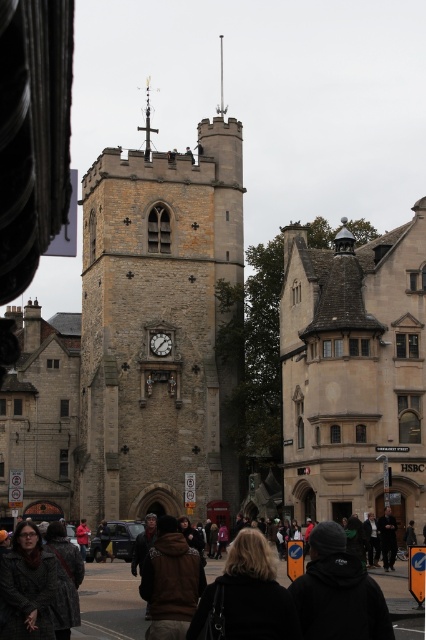
You are a tourist standing on the street in front of the historic stone tower. You see a dark brown leather jacket at lower center and a white marble clock at center. Which object is closer to the beige building with a sloped roof?

The dark brown leather jacket at lower center is closer to the beige building with a sloped roof because it is positioned to the right of the white marble clock at center, and the beige building is located to the right of the tower.

You are a tourist standing on the street in front of the brown stone clock tower at center. You notice a dark brown leather jacket at lower center. Can you see the jacket through the tower?

The dark brown leather jacket at lower center is behind the brown stone clock tower at center, so you cannot see the jacket through the tower.